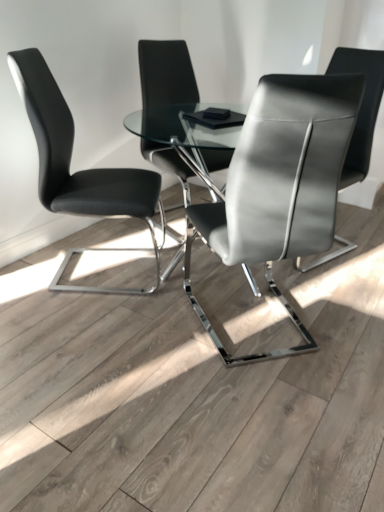
This screenshot has width=384, height=512. Identify the location of free spot below black leather chair at left, which is counted as the 1th chair, starting from the left (from a real-world perspective). (87, 268).